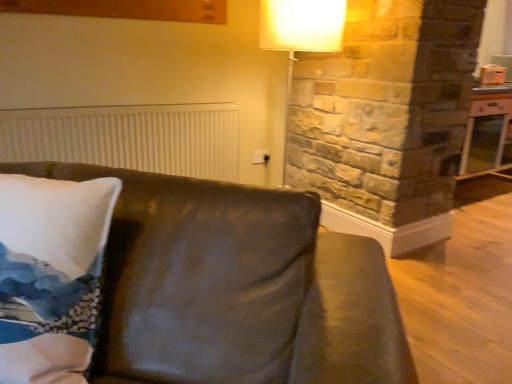
Question: Can you see white ribbed radiator at upper left touching leather couch at center?

Choices:
 (A) no
 (B) yes

Answer: (A)

Question: Is white ribbed radiator at upper left not inside leather couch at center?

Choices:
 (A) no
 (B) yes

Answer: (B)

Question: From a real-world perspective, is white ribbed radiator at upper left positioned under leather couch at center based on gravity?

Choices:
 (A) no
 (B) yes

Answer: (A)

Question: Considering the relative sizes of white ribbed radiator at upper left and leather couch at center in the image provided, is white ribbed radiator at upper left taller than leather couch at center?

Choices:
 (A) no
 (B) yes

Answer: (A)

Question: Is white ribbed radiator at upper left not near leather couch at center?

Choices:
 (A) no
 (B) yes

Answer: (B)

Question: From a real-world perspective, is white ribbed radiator at upper left on top of leather couch at center?

Choices:
 (A) no
 (B) yes

Answer: (B)

Question: From a real-world perspective, is leather couch at center under white ribbed radiator at upper left?

Choices:
 (A) no
 (B) yes

Answer: (B)

Question: Can you confirm if leather couch at center is wider than white ribbed radiator at upper left?

Choices:
 (A) yes
 (B) no

Answer: (A)

Question: Is white ribbed radiator at upper left a part of leather couch at center?

Choices:
 (A) no
 (B) yes

Answer: (A)

Question: Can you confirm if leather couch at center is positioned to the left of white ribbed radiator at upper left?

Choices:
 (A) no
 (B) yes

Answer: (A)

Question: Is leather couch at center outside white ribbed radiator at upper left?

Choices:
 (A) no
 (B) yes

Answer: (B)

Question: Is leather couch at center smaller than white ribbed radiator at upper left?

Choices:
 (A) yes
 (B) no

Answer: (B)

Question: Is the position of leather couch at center more distant than that of wooden table at right?

Choices:
 (A) yes
 (B) no

Answer: (B)